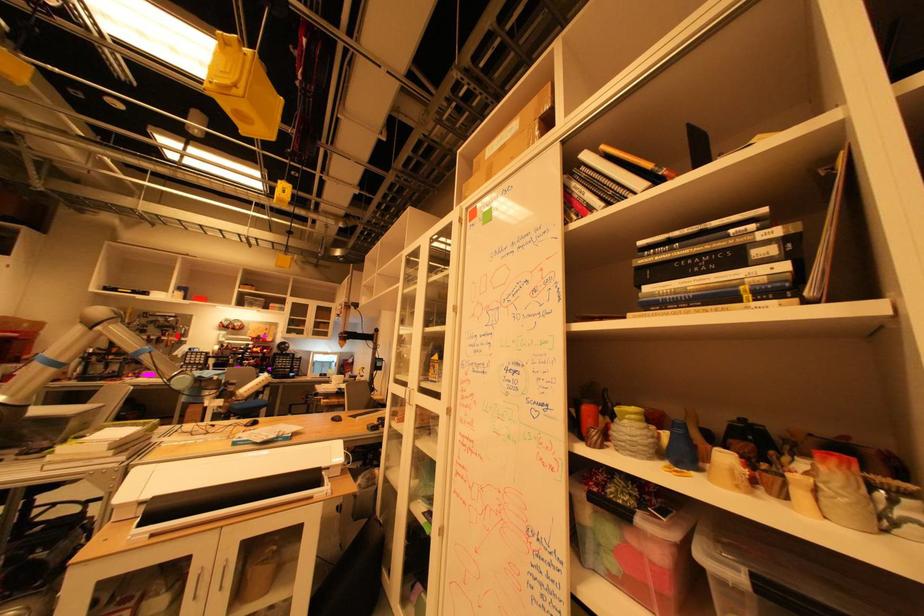
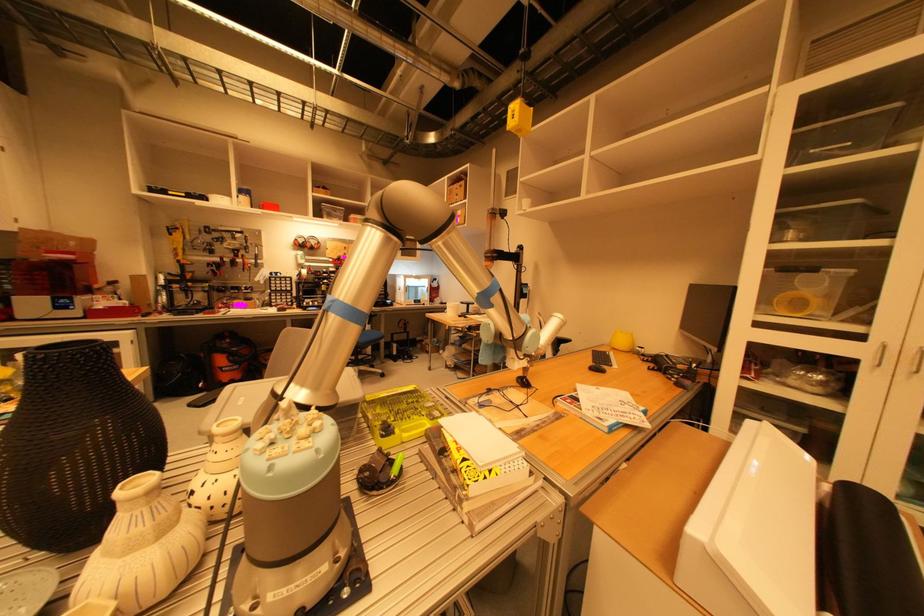
Question: I am providing you with two images of the same scene from different viewpoints. Image1 has a red point marked. In image2, the corresponding 3D location appears at what relative position? Reply with the corresponding letter.

Choices:
 (A) Closer
 (B) Farther

Answer: (A)